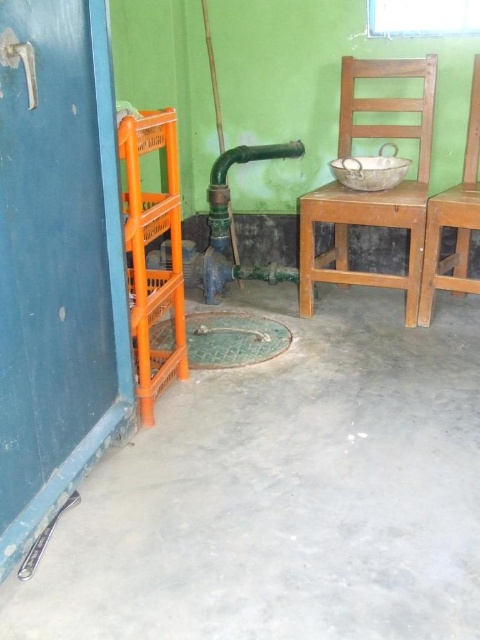
Question: Which of the following is the farthest from the observer?

Choices:
 (A) wooden chair at center
 (B) wooden chair at right

Answer: (A)

Question: Can you confirm if wooden chair at center is wider than wooden chair at right?

Choices:
 (A) yes
 (B) no

Answer: (A)

Question: Is wooden chair at center further to the viewer compared to wooden chair at right?

Choices:
 (A) yes
 (B) no

Answer: (A)

Question: Which of the following is the farthest from the observer?

Choices:
 (A) wooden chair at center
 (B) wooden chair at right

Answer: (A)

Question: Does wooden chair at center come behind wooden chair at right?

Choices:
 (A) yes
 (B) no

Answer: (A)

Question: Among these points, which one is nearest to the camera?

Choices:
 (A) (305, 230)
 (B) (466, 260)

Answer: (A)